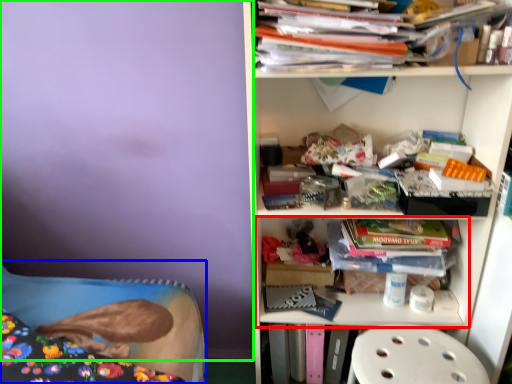
Question: Which is nearer to the shelf (highlighted by a red box)? bed (highlighted by a blue box) or backdrop (highlighted by a green box).

Choices:
 (A) bed
 (B) backdrop

Answer: (A)